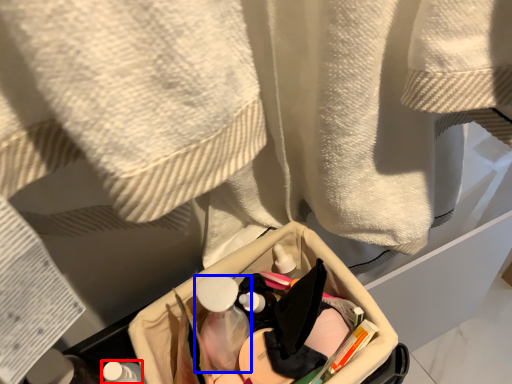
Question: Which object is further to the camera taking this photo, toiletry (highlighted by a red box) or mouthwash (highlighted by a blue box)?

Choices:
 (A) toiletry
 (B) mouthwash

Answer: (B)